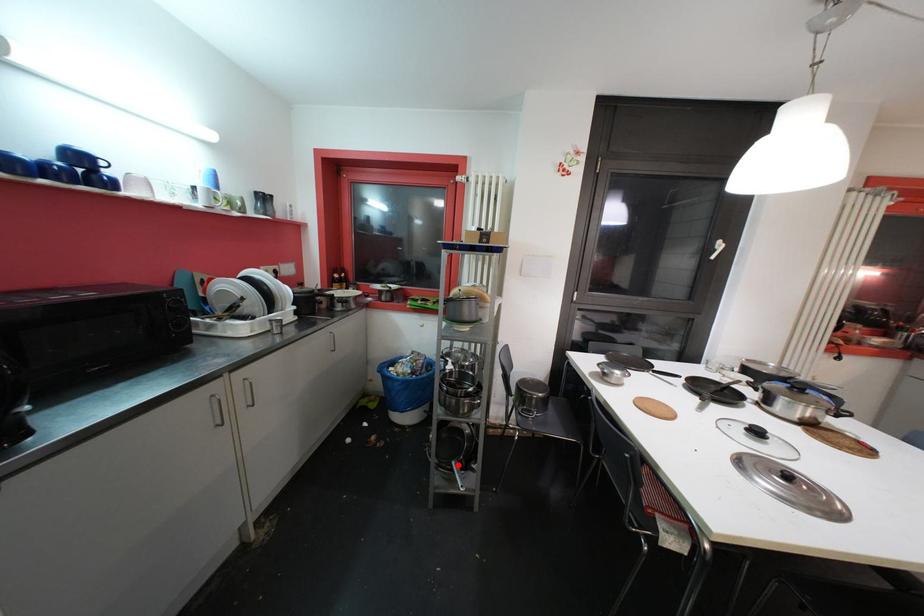
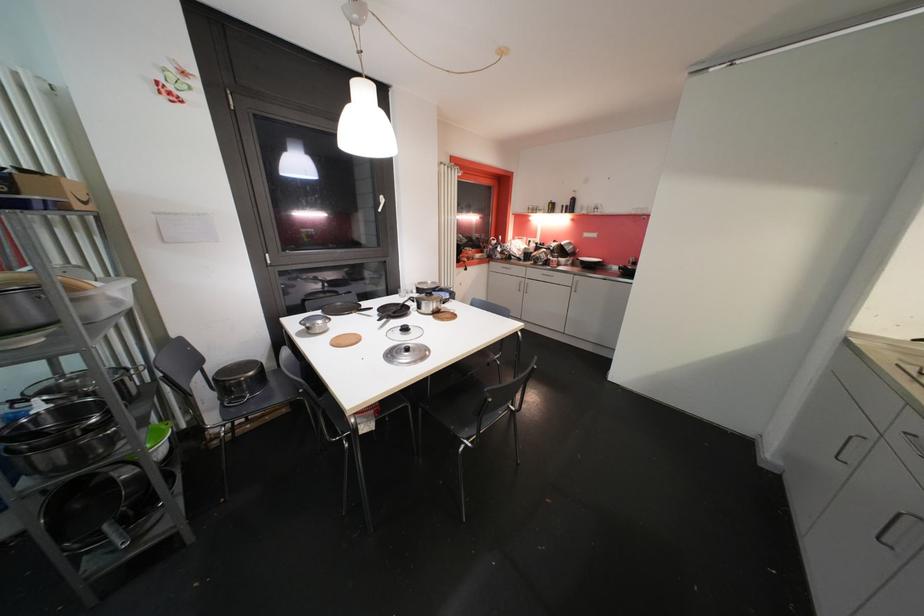
Question: A red point is marked in image1. In image2, is the corresponding 3D point closer to the camera or farther? Reply with the corresponding letter.

Choices:
 (A) The corresponding 3D point is closer.
 (B) The corresponding 3D point is farther.

Answer: (A)